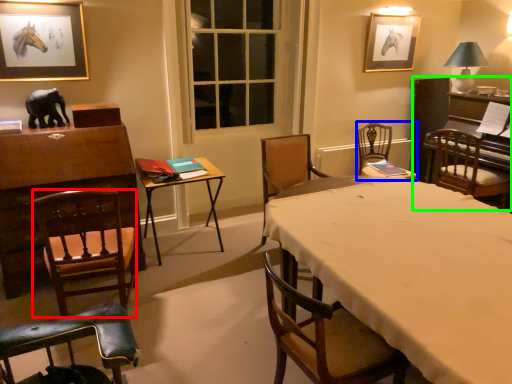
Question: Which object is the farthest from chair (highlighted by a red box)? Choose among these: chair (highlighted by a blue box) or piano (highlighted by a green box).

Choices:
 (A) chair
 (B) piano

Answer: (B)